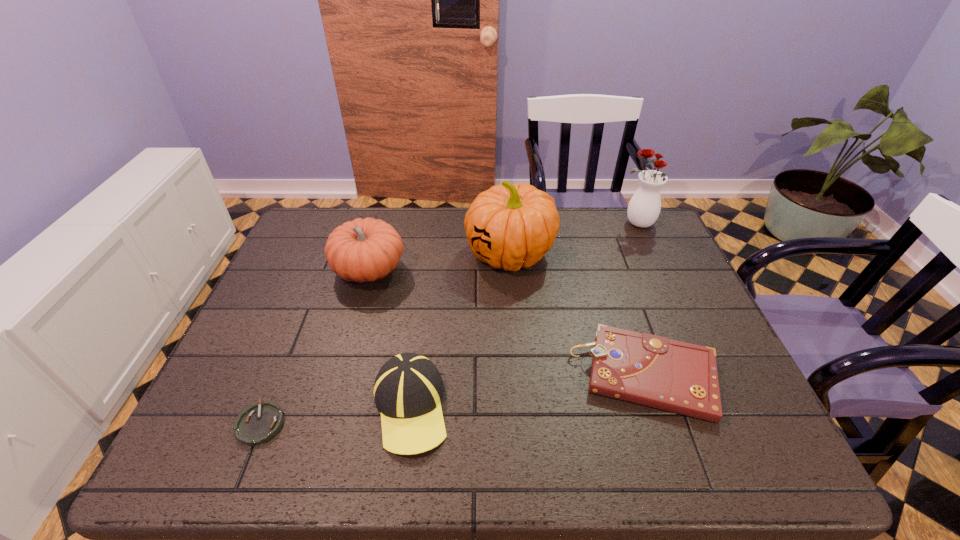
The height and width of the screenshot is (540, 960). What are the coordinates of `notebook situated at the right edge` in the screenshot? It's located at (646, 369).

You are a GUI agent. You are given a task and a screenshot of the screen. Output one action in this format:
    pyautogui.click(x=<x>, y=<y>)
    Task: Click on the object at the far left corner
    Image resolution: width=960 pixels, height=540 pixels.
    Given the screenshot: What is the action you would take?
    pyautogui.click(x=363, y=250)

This screenshot has height=540, width=960. What are the coordinates of `object situated at the near left corner` in the screenshot? It's located at (257, 424).

This screenshot has width=960, height=540. I want to click on object that is at the far right corner, so click(x=644, y=207).

Where is `vacant point at the far edge`? This screenshot has width=960, height=540. vacant point at the far edge is located at coordinates (386, 222).

The image size is (960, 540). I want to click on vacant space at the near edge of the desktop, so click(641, 467).

At what (x,y) coordinates should I click in order to perform the action: click on vacant space at the left edge of the desktop. Please return your answer as a coordinate pair (x, y). Image resolution: width=960 pixels, height=540 pixels. Looking at the image, I should click on (228, 377).

Where is `free space at the right edge`? free space at the right edge is located at coordinates (667, 282).

Locate an element on the screen. This screenshot has height=540, width=960. vacant space at the far left corner of the desktop is located at coordinates (309, 248).

You are a GUI agent. You are given a task and a screenshot of the screen. Output one action in this format:
    pyautogui.click(x=<x>, y=<y>)
    Task: Click on the empty space between the notebook and the third tallest object
    The width and height of the screenshot is (960, 540).
    Given the screenshot: What is the action you would take?
    pyautogui.click(x=508, y=322)